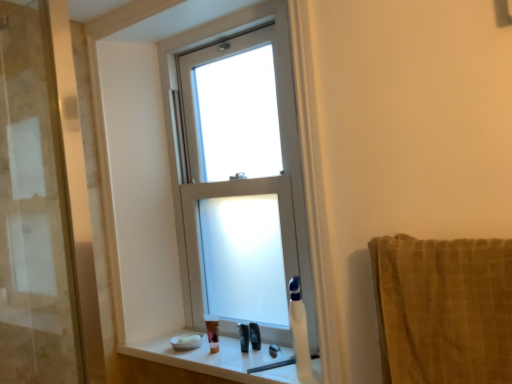
Question: Which direction should I rotate to face black plastic razor at lower center, which is the 3th toiletry in left-to-right order, — up or down?

Choices:
 (A) up
 (B) down

Answer: (B)

Question: Is translucent plastic soap at lower center, the 3th toiletry in the right-to-left sequence, at the right side of black plastic razor at lower center, which is the 3th toiletry in left-to-right order?

Choices:
 (A) no
 (B) yes

Answer: (A)

Question: Is translucent plastic soap at lower center, acting as the 1th toiletry starting from the left, surrounding black plastic razor at lower center, marked as the 1th toiletry in a right-to-left arrangement?

Choices:
 (A) yes
 (B) no

Answer: (B)

Question: From the image's perspective, is translucent plastic soap at lower center, the 3th toiletry in the right-to-left sequence, beneath black plastic razor at lower center, marked as the 1th toiletry in a right-to-left arrangement?

Choices:
 (A) yes
 (B) no

Answer: (A)

Question: Is translucent plastic soap at lower center, the 3th toiletry in the right-to-left sequence, looking in the opposite direction of black plastic razor at lower center, which is the 3th toiletry in left-to-right order?

Choices:
 (A) yes
 (B) no

Answer: (B)

Question: Considering the relative sizes of translucent plastic soap at lower center, the 3th toiletry in the right-to-left sequence, and black plastic razor at lower center, which is the 3th toiletry in left-to-right order, in the image provided, is translucent plastic soap at lower center, the 3th toiletry in the right-to-left sequence, shorter than black plastic razor at lower center, which is the 3th toiletry in left-to-right order,?

Choices:
 (A) no
 (B) yes

Answer: (A)

Question: Is translucent plastic soap at lower center, the 3th toiletry in the right-to-left sequence, taller than black plastic razor at lower center, marked as the 1th toiletry in a right-to-left arrangement?

Choices:
 (A) no
 (B) yes

Answer: (B)

Question: From a real-world perspective, is white frosted glass window at center located higher than white plastic window frame at center?

Choices:
 (A) yes
 (B) no

Answer: (B)

Question: Is white frosted glass window at center far away from white plastic window frame at center?

Choices:
 (A) no
 (B) yes

Answer: (A)

Question: Does white frosted glass window at center have a lesser height compared to white plastic window frame at center?

Choices:
 (A) yes
 (B) no

Answer: (A)

Question: From the image's perspective, does white frosted glass window at center appear lower than white plastic window frame at center?

Choices:
 (A) no
 (B) yes

Answer: (B)

Question: Is white frosted glass window at center to the right of white plastic window frame at center from the viewer's perspective?

Choices:
 (A) no
 (B) yes

Answer: (B)

Question: Is white frosted glass window at center placed right next to white plastic window frame at center?

Choices:
 (A) yes
 (B) no

Answer: (B)

Question: From a real-world perspective, is white plastic soap dispenser at lower right positioned under white frosted glass window at center based on gravity?

Choices:
 (A) yes
 (B) no

Answer: (A)